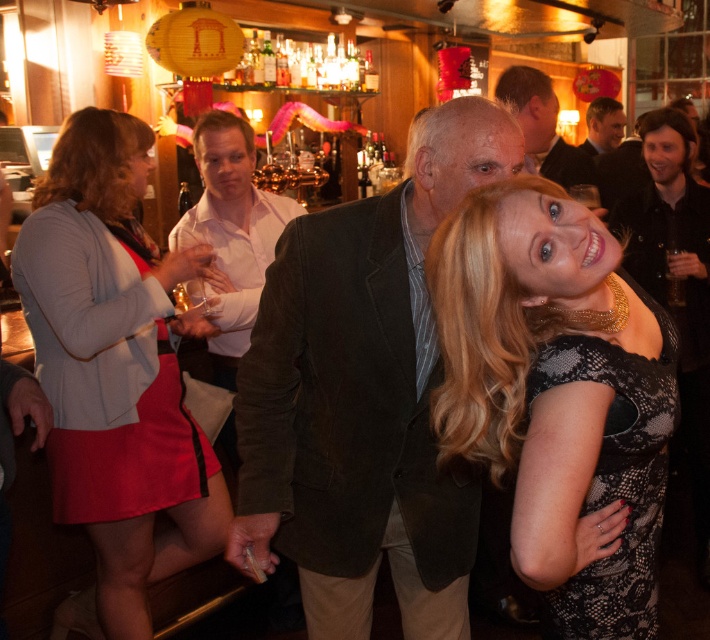
Question: Can you confirm if matte brown jacket at center is positioned to the left of dark brown leather jacket at upper center?

Choices:
 (A) no
 (B) yes

Answer: (B)

Question: Among these points, which one is farthest from the camera?

Choices:
 (A) pyautogui.click(x=555, y=128)
 (B) pyautogui.click(x=596, y=152)
 (C) pyautogui.click(x=209, y=280)

Answer: (B)

Question: Is matte red skirt at left to the right of matte brown jacket at center from the viewer's perspective?

Choices:
 (A) yes
 (B) no

Answer: (B)

Question: Considering the relative positions of black lace dress at center and matte brown jacket at center in the image provided, where is black lace dress at center located with respect to matte brown jacket at center?

Choices:
 (A) left
 (B) right

Answer: (B)

Question: Which point is farther from the camera taking this photo?

Choices:
 (A) (207, 211)
 (B) (202, 436)

Answer: (A)

Question: Which of the following is the farthest from the observer?

Choices:
 (A) black lace dress at center
 (B) matte brown jacket at center
 (C) matte red skirt at left
 (D) dark brown leather jacket at upper center

Answer: (D)